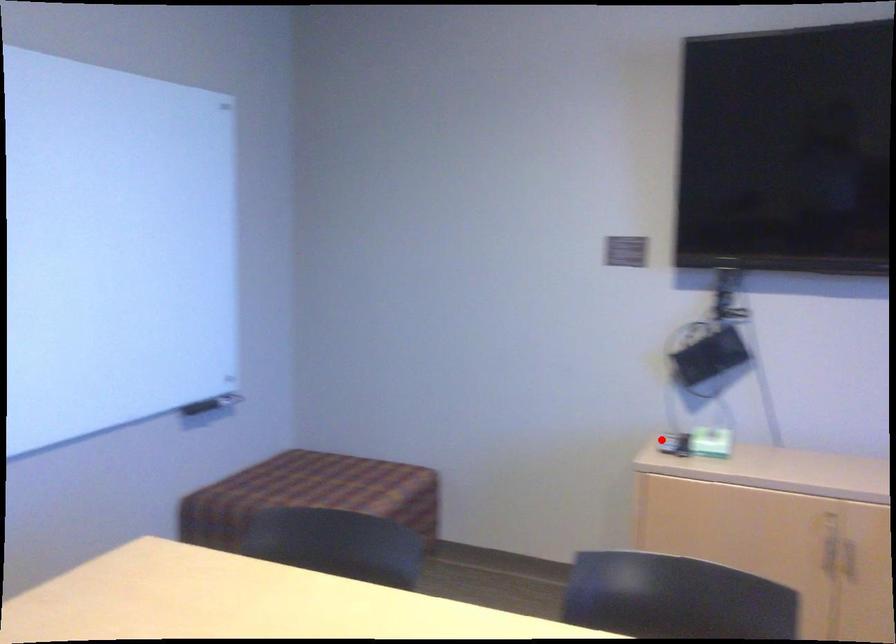
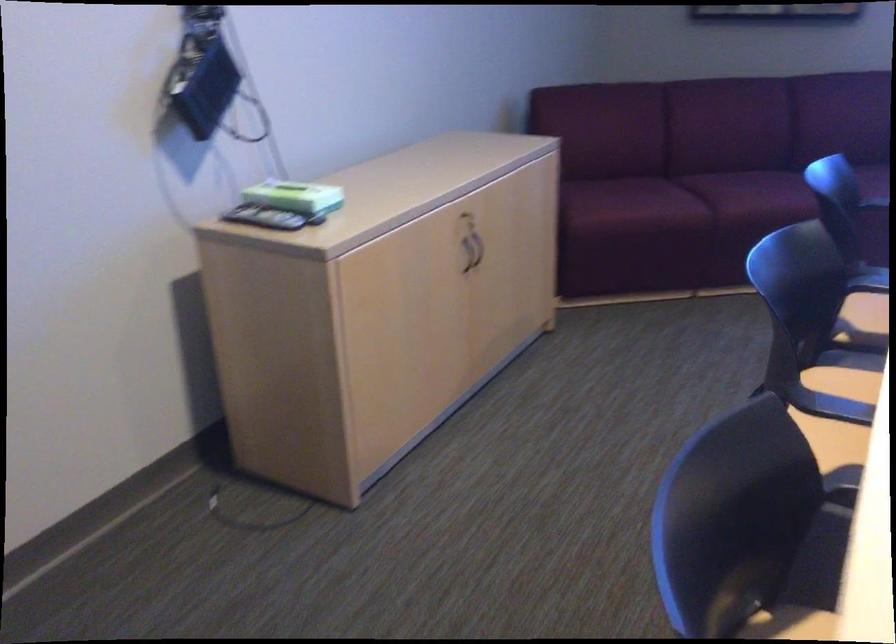
Question: I am providing you with two images of the same scene from different viewpoints. A red point is shown in image1. For the corresponding object point in image2, is it positioned nearer or farther from the camera?

Choices:
 (A) Nearer
 (B) Farther

Answer: (A)